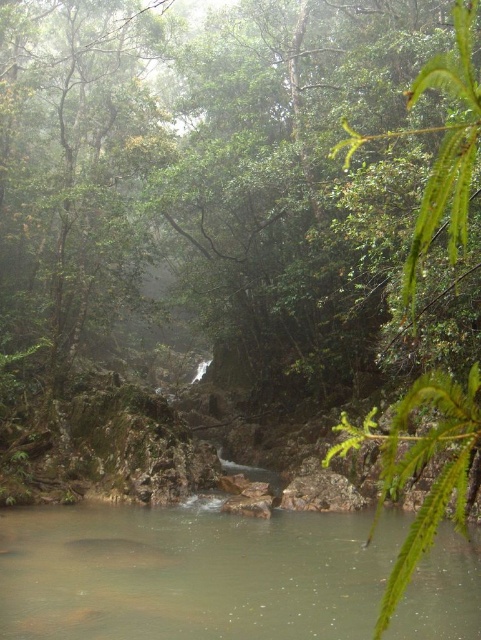
You are a hiker who wants to cross the brown smooth river at center. You notice a green leafy tree at right nearby. Which object takes up more space in the scene?

The green leafy tree at right takes up more space in the scene than the brown smooth river at center, as the brown smooth river at center is smaller than the green leafy tree at right according to the description.

You are standing in the forest and want to cross the brown smooth river at center. To your right, there is a green leafy tree at right. Which object is closer to you, the river or the tree?

The brown smooth river at center is closer to you than the green leafy tree at right because it is further to the viewer.

You are a hiker who wants to cross the brown smooth river at center. There is a green leafy tree at right nearby. Which direction should you go relative to the tree to find a safe path?

The brown smooth river at center is positioned on the left side of green leafy tree at right, so to find a safe path, you should go to the right side of the tree.